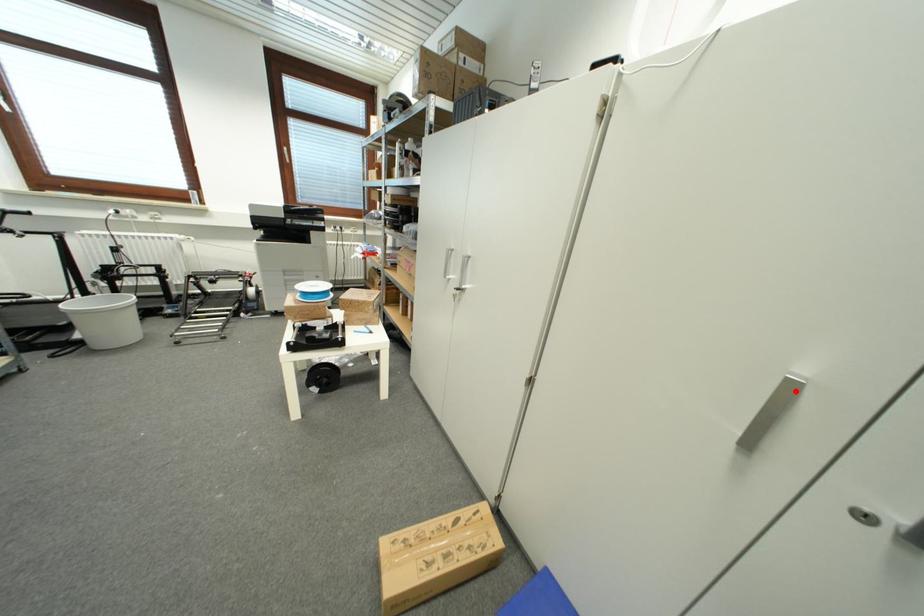
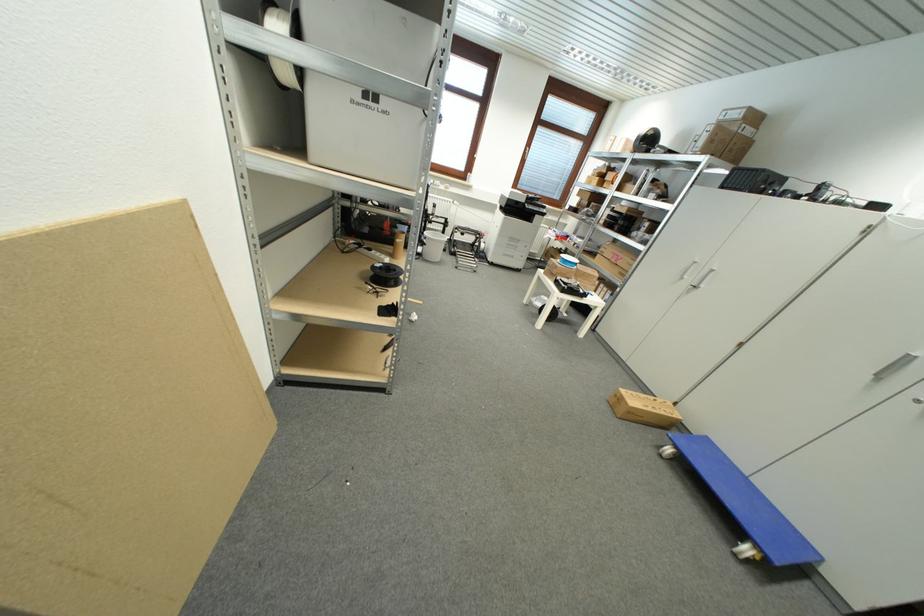
The point at the highlighted location is marked in the first image. Where is the corresponding point in the second image?

(913, 361)